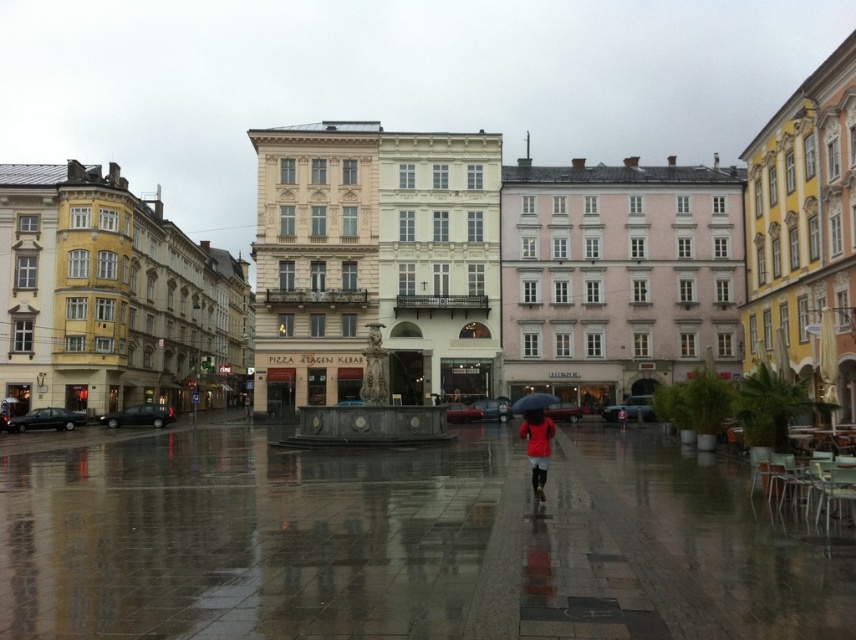
Which is below, red matte coat at center or blue matte umbrella at center?

red matte coat at center

Is red matte coat at center further to the viewer compared to blue matte umbrella at center?

No.

Locate an element on the screen. This screenshot has height=640, width=856. red matte coat at center is located at coordinates (538, 445).

You are a GUI agent. You are given a task and a screenshot of the screen. Output one action in this format:
    pyautogui.click(x=<x>, y=<y>)
    Task: Click on the red matte coat at center
    Image resolution: width=856 pixels, height=640 pixels.
    Given the screenshot: What is the action you would take?
    pyautogui.click(x=538, y=445)